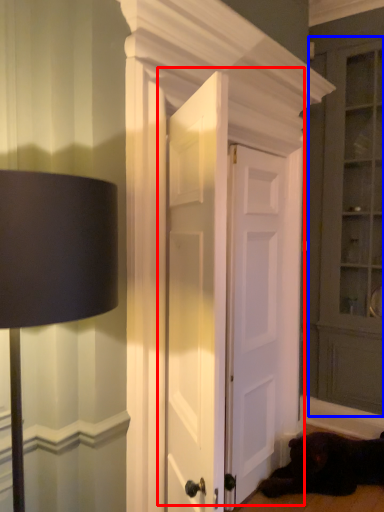
Question: Which object appears farthest to the camera in this image, door (highlighted by a red box) or dresser (highlighted by a blue box)?

Choices:
 (A) door
 (B) dresser

Answer: (B)